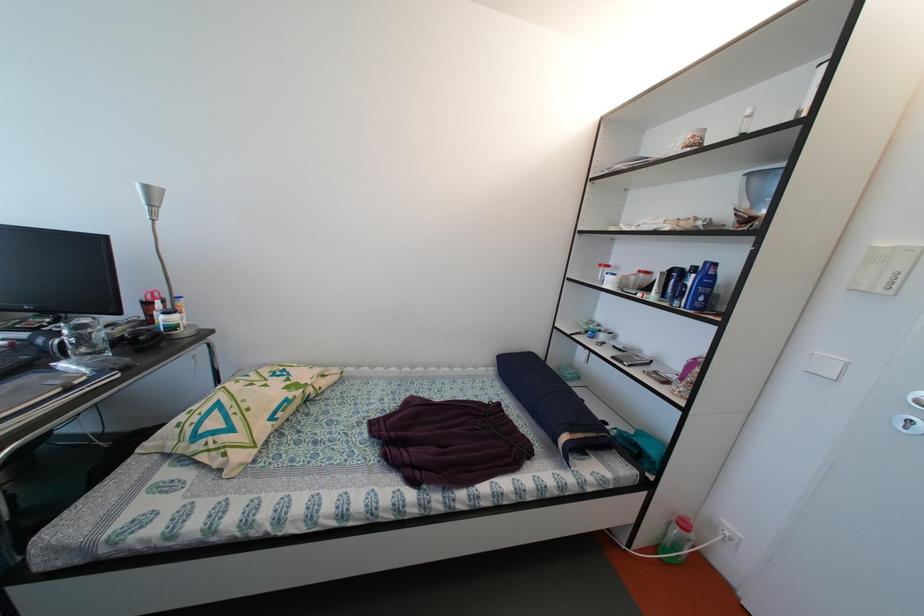
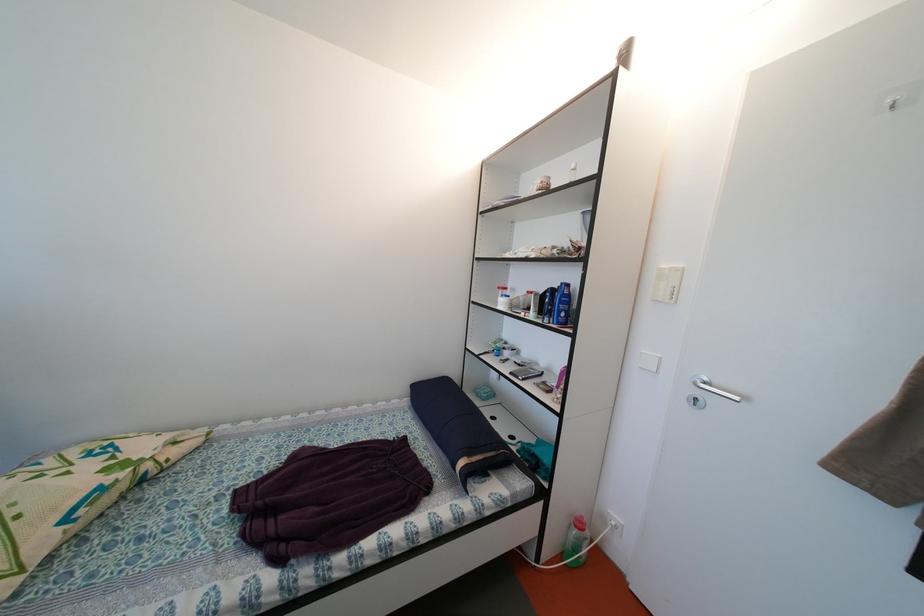
The point at (691, 530) is marked in the first image. Where is the corresponding point in the second image?

(587, 530)